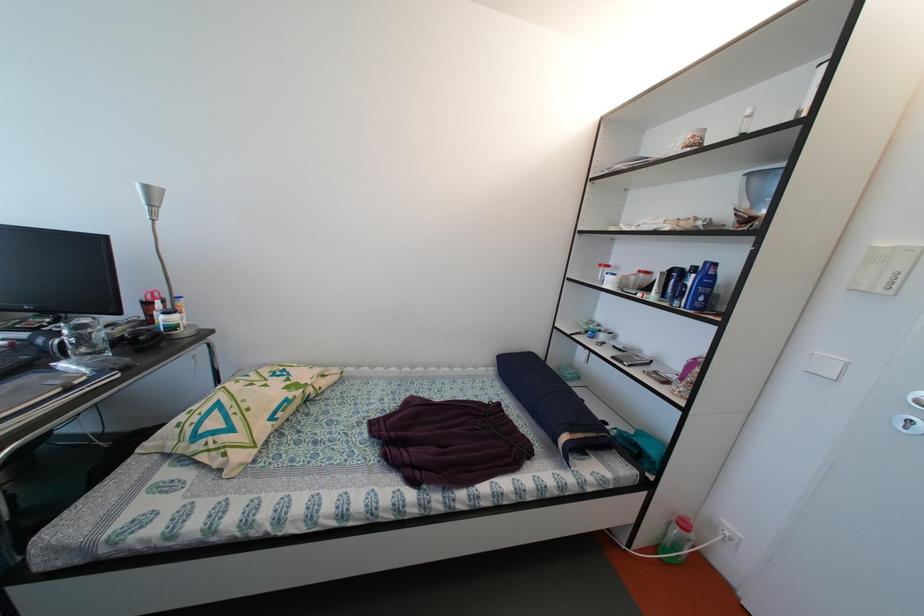
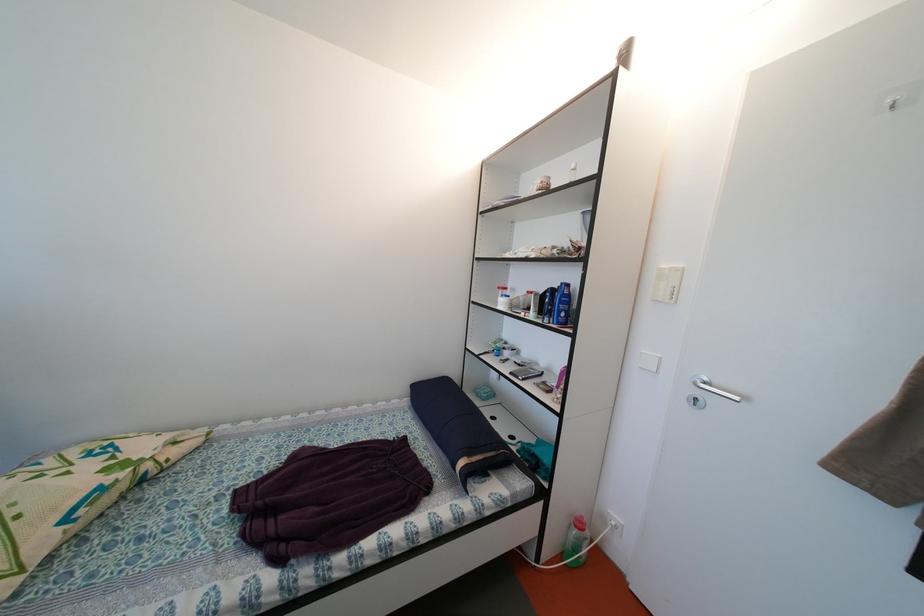
The point at (691, 530) is marked in the first image. Where is the corresponding point in the second image?

(587, 530)